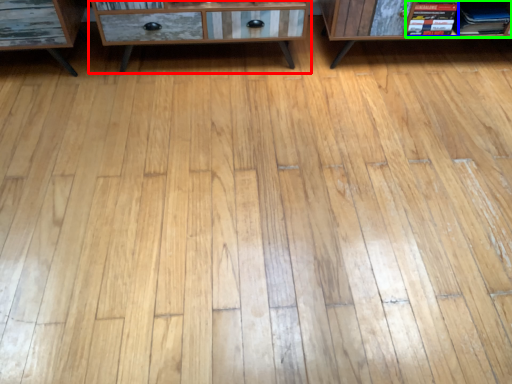
Question: Which is nearer to the chest of drawers (highlighted by a red box)? book (highlighted by a blue box) or book (highlighted by a green box).

Choices:
 (A) book
 (B) book

Answer: (A)